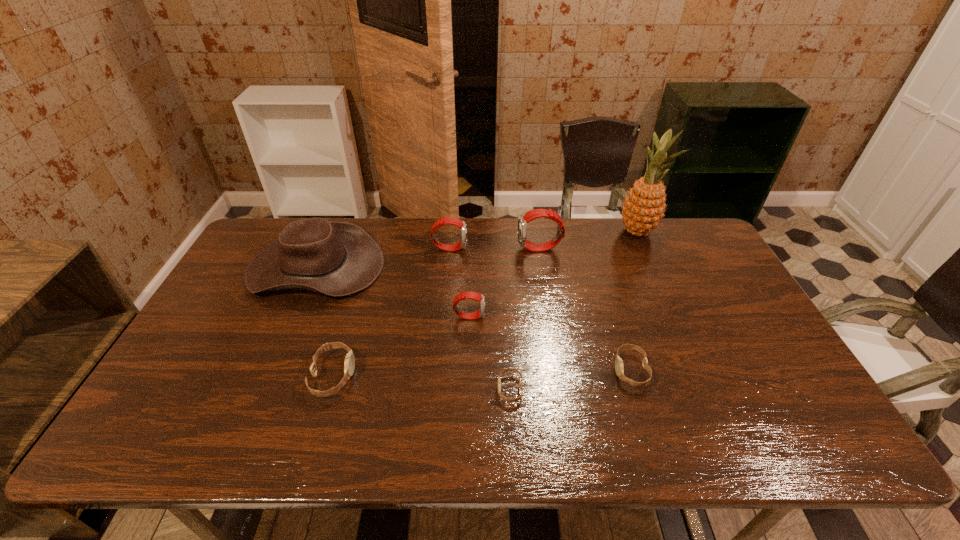
I want to click on cowboy hat that is positioned at the far edge, so click(333, 258).

Locate an element on the screen. Image resolution: width=960 pixels, height=540 pixels. object that is at the left edge is located at coordinates (333, 258).

This screenshot has width=960, height=540. Identify the location of object that is at the right edge. (643, 209).

Where is `object present at the far left corner`? The image size is (960, 540). object present at the far left corner is located at coordinates (333, 258).

The width and height of the screenshot is (960, 540). I want to click on object present at the far right corner, so click(x=643, y=209).

Where is `vacant space at the far edge`? The height and width of the screenshot is (540, 960). vacant space at the far edge is located at coordinates (618, 228).

Identify the location of vacant space at the near edge of the desktop. (573, 418).

This screenshot has height=540, width=960. In order to click on free space at the left edge in this screenshot , I will do `click(247, 310)`.

Locate an element on the screen. The height and width of the screenshot is (540, 960). vacant space at the right edge of the desktop is located at coordinates (718, 276).

At what (x,y) coordinates should I click in order to perform the action: click on vacant space at the far left corner. Please return your answer as a coordinate pair (x, y). This screenshot has width=960, height=540. Looking at the image, I should click on (251, 257).